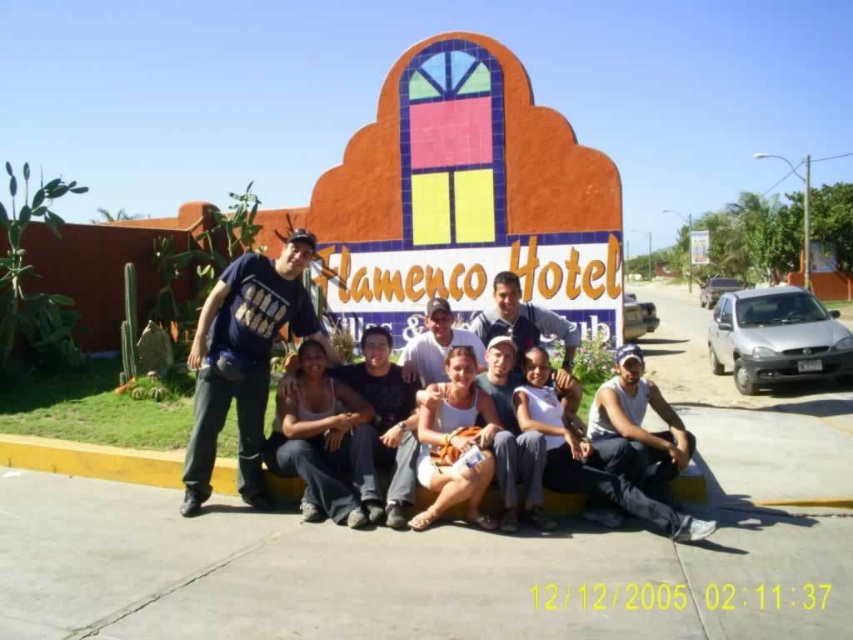
Does matte blue shirt at center appear over white fabric sign at center?

No, matte blue shirt at center is not above white fabric sign at center.

Locate an element on the screen. Image resolution: width=853 pixels, height=640 pixels. matte blue shirt at center is located at coordinates (521, 321).

Where is `matte blue shirt at center`? The width and height of the screenshot is (853, 640). matte blue shirt at center is located at coordinates (521, 321).

Does point (708, 333) come closer to viewer compared to point (653, 321)?

Yes.

Is silver metallic car at right below silver metallic car at center?

Yes.

Does point (711, 356) come farther from viewer compared to point (634, 298)?

That is False.

I want to click on silver metallic car at right, so click(776, 337).

Consider the image. Is dark blue t-shirt at left above white fabric tank top at center?

Yes, dark blue t-shirt at left is above white fabric tank top at center.

Is dark blue t-shirt at left positioned before white fabric tank top at center?

No, dark blue t-shirt at left is further to the viewer.

Is point (242, 470) in front of point (474, 436)?

No.

Identify the location of dark blue t-shirt at left. The height and width of the screenshot is (640, 853). (244, 360).